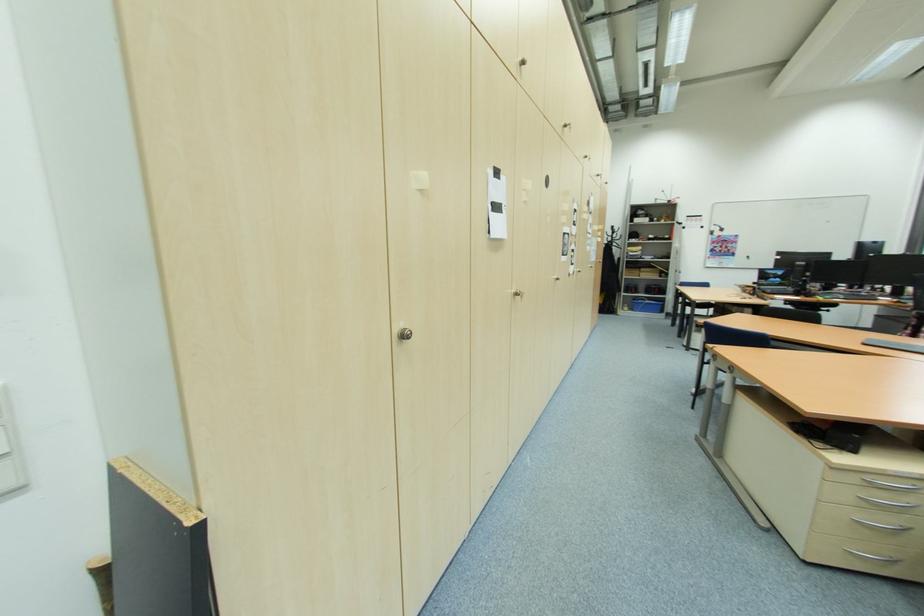
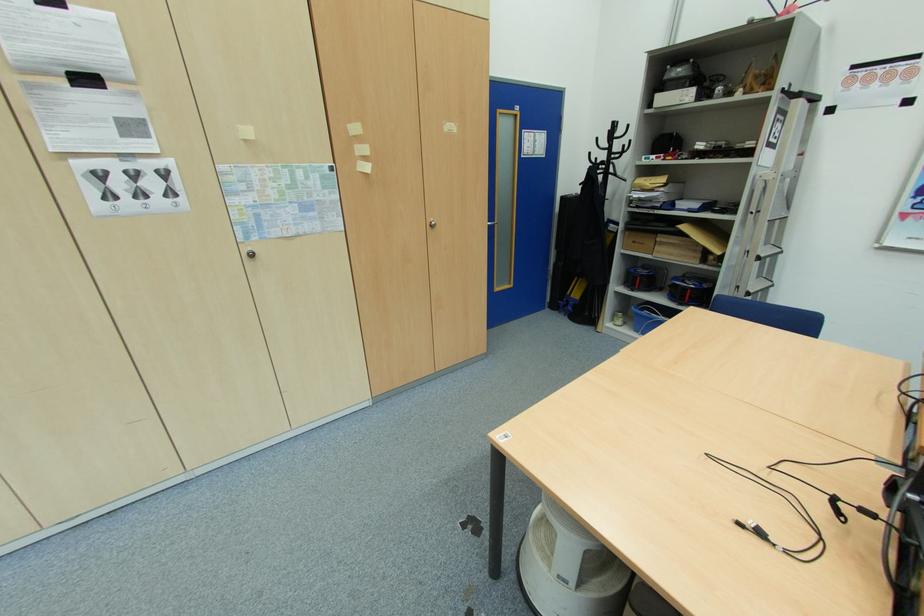
Locate, in the second image, the point that corresponds to (618,232) in the first image.

(619, 136)